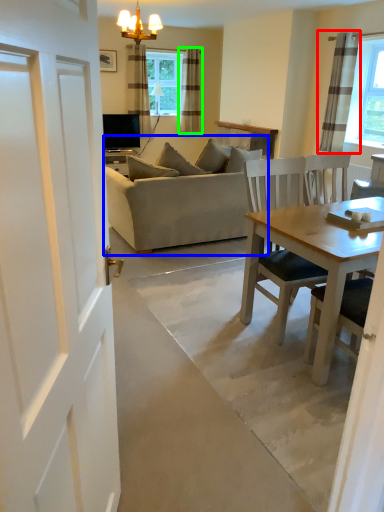
Question: Considering the real-world distances, which object is closest to curtain (highlighted by a red box)? studio couch (highlighted by a blue box) or curtain (highlighted by a green box).

Choices:
 (A) studio couch
 (B) curtain

Answer: (A)